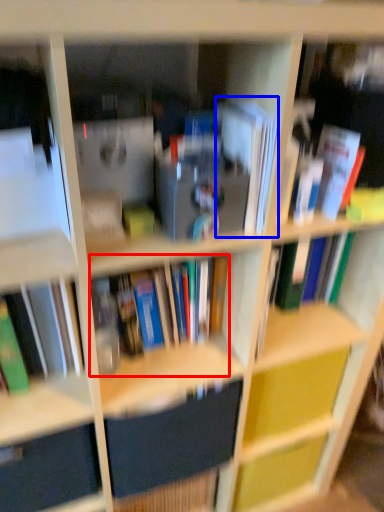
Question: Which point is closer to the camera, book (highlighted by a red box) or paperback book (highlighted by a blue box)?

Choices:
 (A) book
 (B) paperback book

Answer: (B)